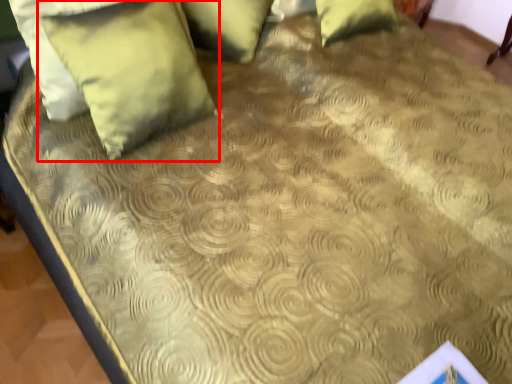
Question: From the image's perspective, where is pillow (annotated by the red box) located relative to pillow?

Choices:
 (A) above
 (B) below

Answer: (B)